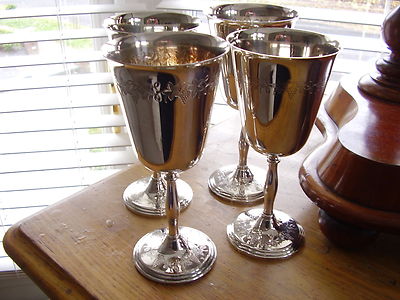
This screenshot has width=400, height=300. Identify the location of wood table. (84, 230).